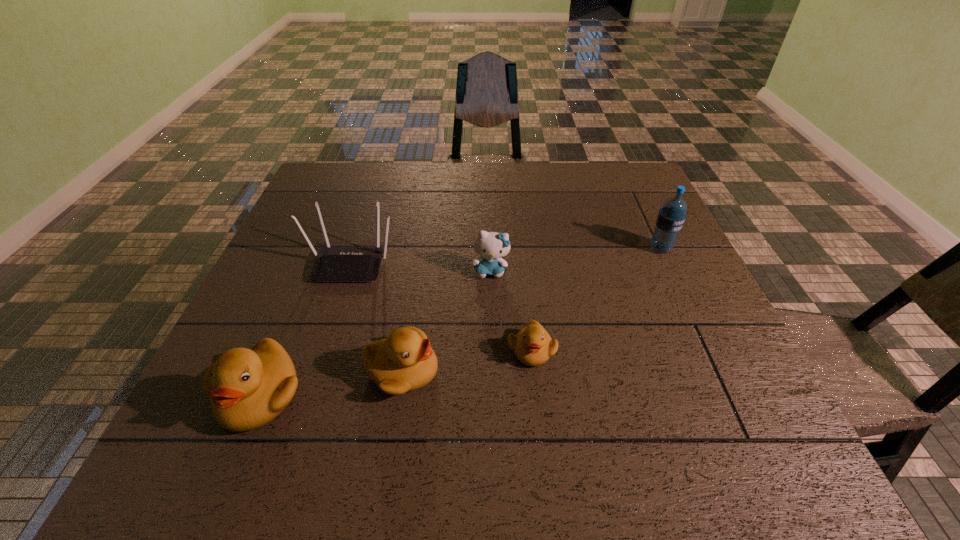
In order to click on the leftmost duckling in this screenshot , I will do `click(248, 388)`.

Find the location of `the second shortest duckling`. the second shortest duckling is located at coordinates (405, 361).

Where is `the shortest object`? This screenshot has width=960, height=540. the shortest object is located at coordinates (532, 345).

You are a GUI agent. You are given a task and a screenshot of the screen. Output one action in this format:
    pyautogui.click(x=<x>, y=<y>)
    Task: Click on the shortest duckling
    This screenshot has height=540, width=960.
    Given the screenshot: What is the action you would take?
    pyautogui.click(x=532, y=345)

Find the location of a particular element. kitten is located at coordinates click(x=490, y=246).

Locate an element on the screen. Image resolution: width=960 pixels, height=540 pixels. water bottle is located at coordinates (670, 219).

You are a GUI agent. You are given a task and a screenshot of the screen. Output one action in this format:
    pyautogui.click(x=<x>, y=<y>)
    Task: Click on the tallest object
    This screenshot has height=540, width=960.
    Given the screenshot: What is the action you would take?
    pyautogui.click(x=670, y=219)

Where is `router`? This screenshot has height=540, width=960. router is located at coordinates (333, 264).

Locate an element on the screen. The image size is (960, 540). free spot located 0.350m on the front-facing side of the second shortest duckling is located at coordinates (616, 371).

This screenshot has height=540, width=960. Identify the location of free location located 0.070m on the front-facing side of the shortest object. (537, 401).